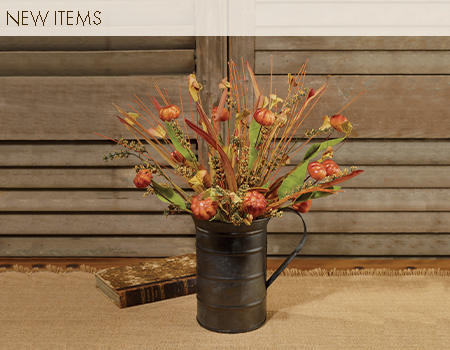
Where is `wooden counter top`? This screenshot has width=450, height=350. wooden counter top is located at coordinates (322, 263).